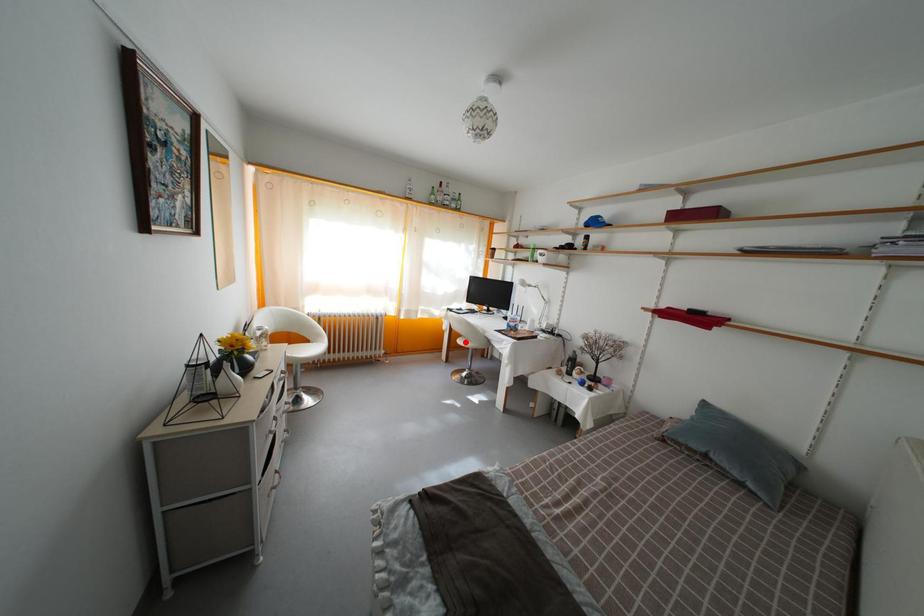
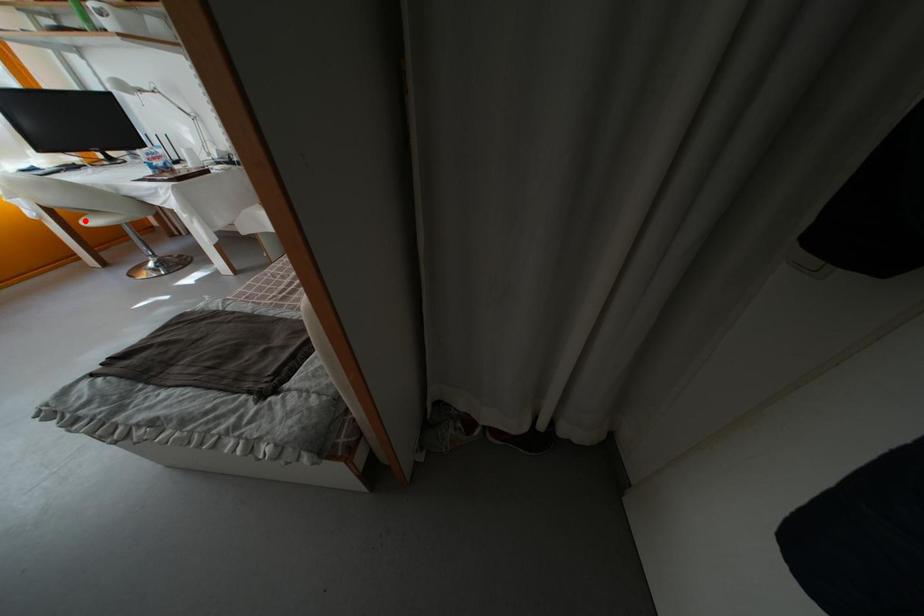
I am providing you with two images of the same scene from different viewpoints. A red point is marked on the first image and another point is marked on the second image. Does the point marked in image1 correspond to the same location as the one in image2?

Yes